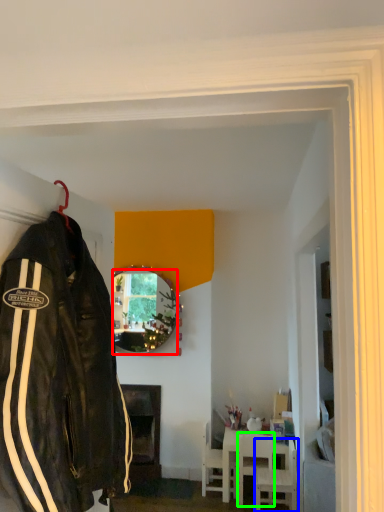
Question: Which object is positioned closest to mirror (highlighted by a red box)? Select from chair (highlighted by a blue box) and chair (highlighted by a green box).

Choices:
 (A) chair
 (B) chair

Answer: (B)